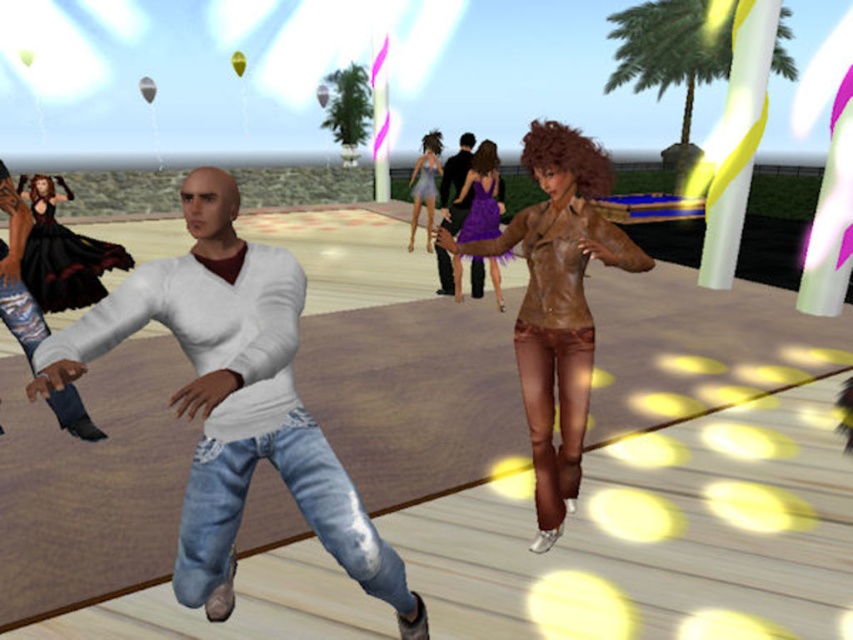
You are a photographer at the party and want to capture both the matte white sweater at center and the shiny silver dress at center in a single frame. Which object should you focus on first to ensure both are in the frame?

You should focus on the shiny silver dress at center first because it is larger than the matte white sweater at center, ensuring both fit within the frame.